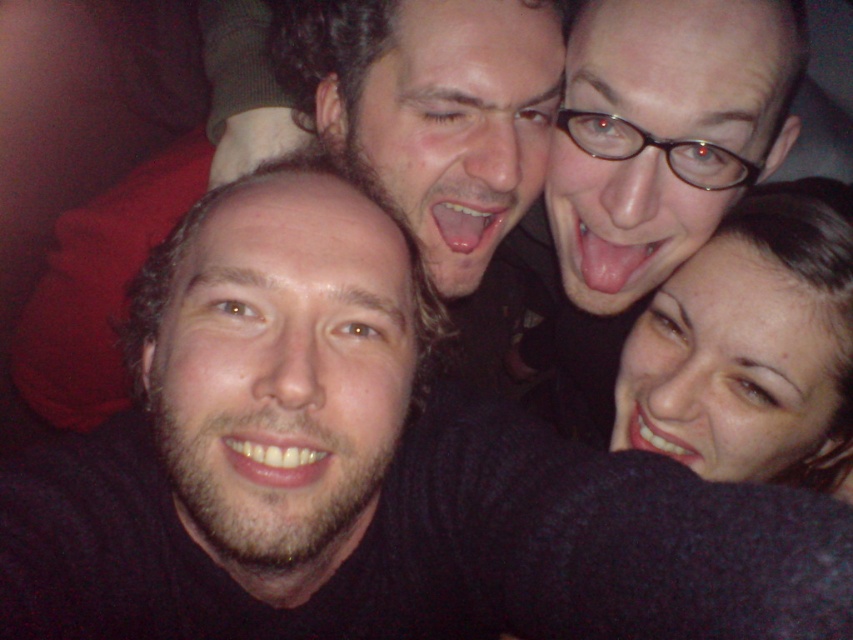
You are a photographer trying to capture a closeup shot of the pink flesh at center and the white glossy teeth at lower right. Which object would require a wider lens to fully capture in the frame?

The pink flesh at center might require a wider lens because it is wider than the white glossy teeth at lower right.

You are standing at a distance of 3.5 feet from the point marked at coordinates (x=688, y=460). Can you reach the point without moving closer?

The distance between you and the point is 3.79 feet, which is greater than 3.5 feet. Therefore, you cannot reach the point without moving closer.